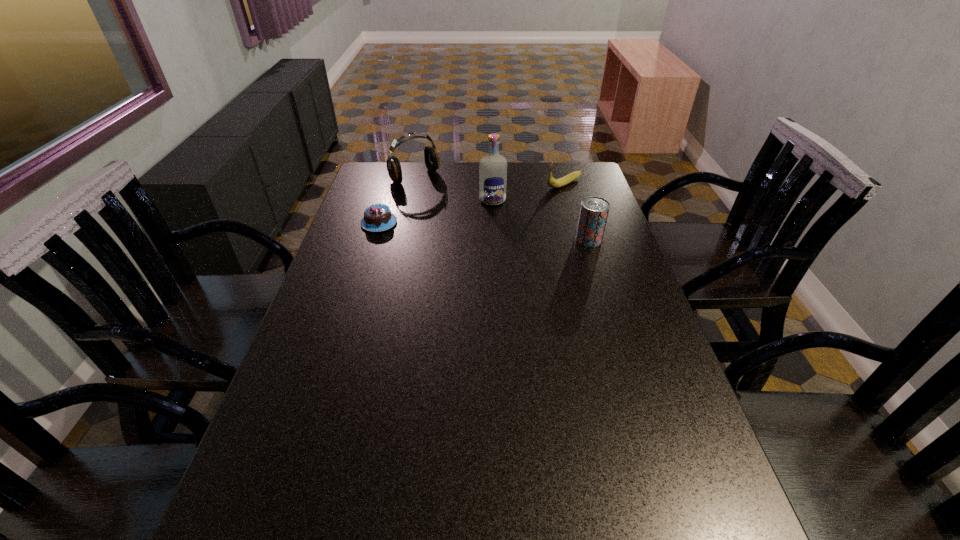
The height and width of the screenshot is (540, 960). Find the location of `chocolate cake`. chocolate cake is located at coordinates (377, 217).

Find the location of a particular element. The height and width of the screenshot is (540, 960). the third shortest object is located at coordinates pos(594,210).

Where is `the second tallest object`? This screenshot has width=960, height=540. the second tallest object is located at coordinates [432, 161].

Identify the location of the third nearest object. (493, 167).

Where is `the tallest object`? This screenshot has height=540, width=960. the tallest object is located at coordinates (493, 167).

The height and width of the screenshot is (540, 960). I want to click on the second shortest object, so click(552, 182).

Where is `blank space located on the front of the shortest object`? Image resolution: width=960 pixels, height=540 pixels. blank space located on the front of the shortest object is located at coordinates (371, 251).

Identify the location of blank area located on the front of the beer can. (598, 268).

Locate an element on the screen. This screenshot has width=960, height=540. vacant region located 0.250m on the ear cups of the second tallest object is located at coordinates (465, 215).

Find the location of `vacant space located on the ear cups of the second tallest object`. vacant space located on the ear cups of the second tallest object is located at coordinates (478, 226).